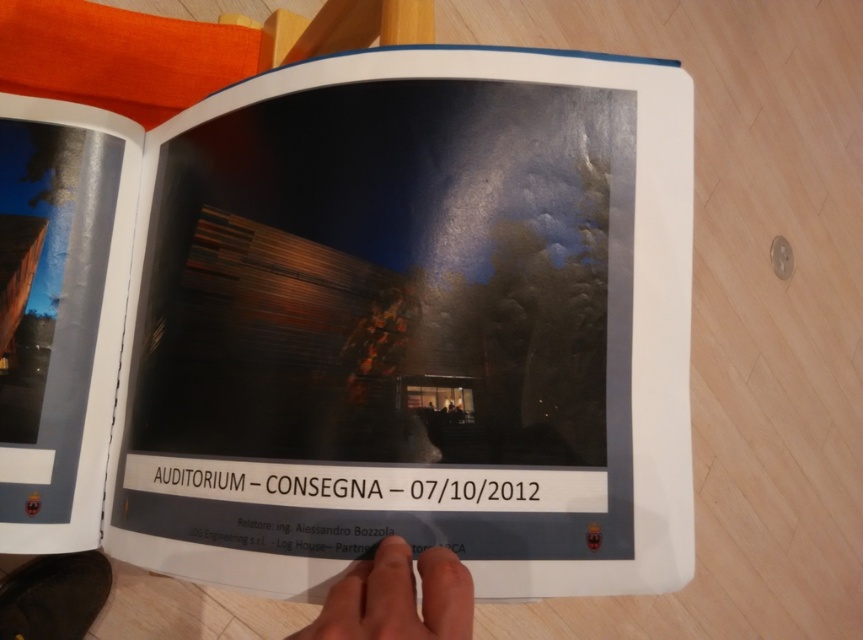
Where is the matte paper book at center located in the image?

The matte paper book at center is located at point coordinates of (413, 324).

You are a photographer reviewing the image of the nighttime auditorium scene in the open book. You notice a point marked at coordinates (x=397, y=598). Based on the book layout, where is this point located relative to the photograph on the right page?

The point at (x=397, y=598) indicates a skin toned hand at lower center, which is located at the lower center of the photograph on the right page.